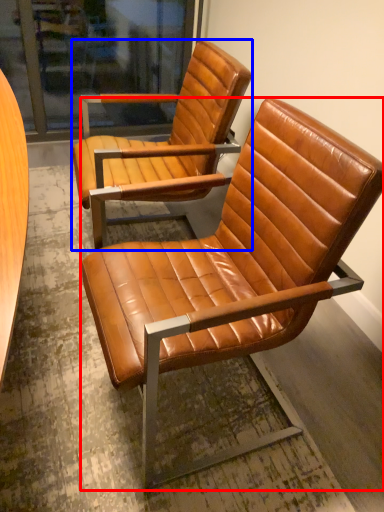
Question: Among these objects, which one is farthest to the camera, chair (highlighted by a red box) or chair (highlighted by a blue box)?

Choices:
 (A) chair
 (B) chair

Answer: (B)